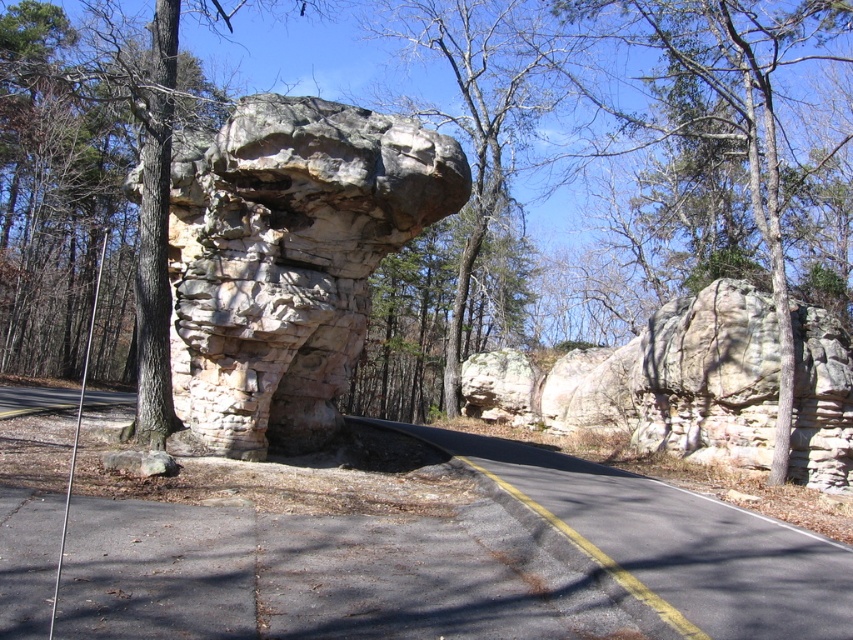
You are a hiker standing on the paved road and see both the gray stone arch at center and the rustic stone arch at center. Which one is located to the left side?

The gray stone arch at center is positioned on the left side of rustic stone arch at center, so the gray stone arch at center is located to the left side.

You are a hiker who wants to pass through the arches in the image. You have a backpack that is 2 meters wide. Can you fit through both the gray stone arch at center and the rustic stone arch at center?

The gray stone arch at center has a larger size compared to rustic stone arch at center. Since the backpack is 2 meters wide, it might fit through the larger gray stone arch at center, but not the smaller rustic stone arch at center.

You are standing at the base of the rock formation and want to walk towards the road. There are two points marked on the ground, point (300,227) and point (492,371). Which point should you step on first to reach the road more quickly?

Point (300,227) is in front of point (492,371), so stepping on point (300,227) first will get you to the road faster.